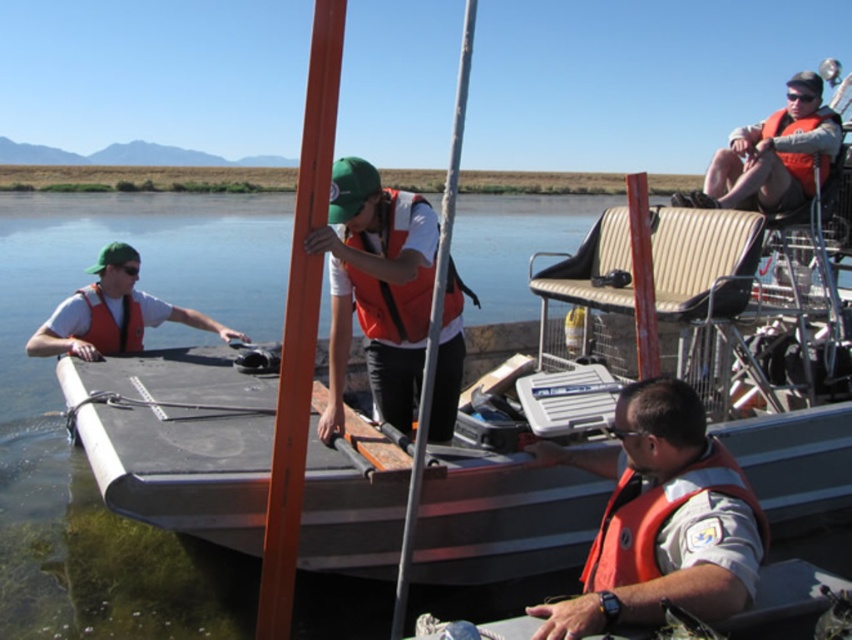
Question: Does matte orange life vest at center appear on the left side of orange life jacket at center?

Choices:
 (A) yes
 (B) no

Answer: (A)

Question: Does orange life vest at lower right appear on the right side of orange life jacket at lower right?

Choices:
 (A) yes
 (B) no

Answer: (B)

Question: Which object is the farthest from the orange life jacket at upper right?

Choices:
 (A) orange life jacket at lower right
 (B) orange life vest at lower right
 (C) matte orange life vest at left
 (D) matte orange life jacket at left

Answer: (D)

Question: Which point is farther from the camera taking this photo?

Choices:
 (A) (231, 330)
 (B) (113, 333)
 (C) (387, 234)

Answer: (A)

Question: Does orange life vest at lower right appear under matte orange life vest at left?

Choices:
 (A) no
 (B) yes

Answer: (B)

Question: Among these objects, which one is farthest from the camera?

Choices:
 (A) orange life jacket at center
 (B) orange life vest at lower right
 (C) matte orange life vest at center

Answer: (A)